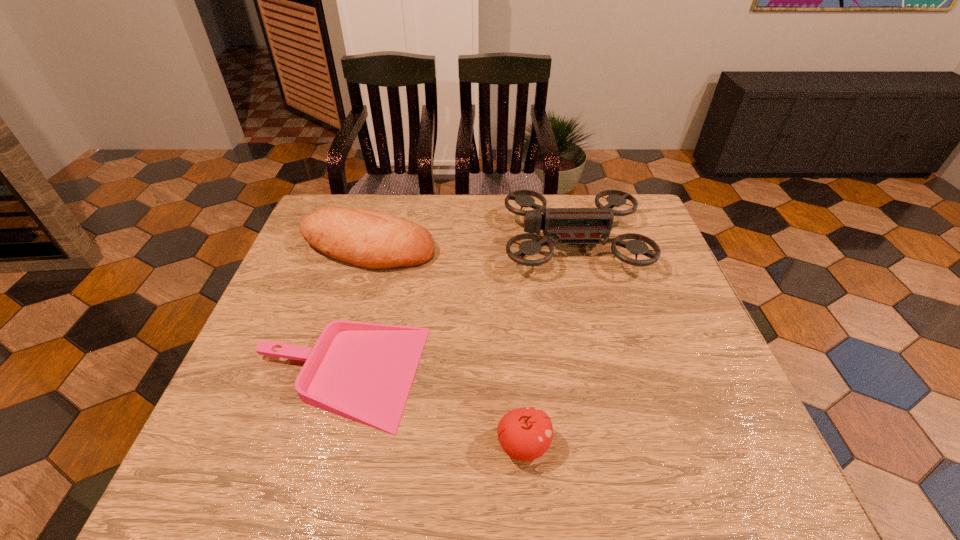
Find the location of a particular element. This screenshot has height=540, width=960. unoccupied area between the bread and the drone is located at coordinates (470, 245).

In order to click on vacant area that lies between the bread and the apple in this screenshot , I will do `click(445, 347)`.

At what (x,y) coordinates should I click in order to perform the action: click on object identified as the second closest to the bread. Please return your answer as a coordinate pair (x, y). Looking at the image, I should click on (361, 371).

Where is `object that stands as the second closest to the drone`? This screenshot has height=540, width=960. object that stands as the second closest to the drone is located at coordinates (361, 371).

Find the location of a particular element. The width and height of the screenshot is (960, 540). vacant region that satisfies the following two spatial constraints: 1. on the front-facing side of the drone; 2. on the front side of the bread is located at coordinates (574, 248).

Where is `free point that satisfies the following two spatial constraints: 1. on the front-facing side of the drone; 2. on the front side of the apple`? This screenshot has width=960, height=540. free point that satisfies the following two spatial constraints: 1. on the front-facing side of the drone; 2. on the front side of the apple is located at coordinates [622, 445].

Locate an element on the screen. free space that satisfies the following two spatial constraints: 1. on the front-facing side of the drone; 2. on the front side of the apple is located at coordinates (622, 445).

Find the location of a particular element. free spot that satisfies the following two spatial constraints: 1. on the front-facing side of the drone; 2. on the front side of the bread is located at coordinates (574, 248).